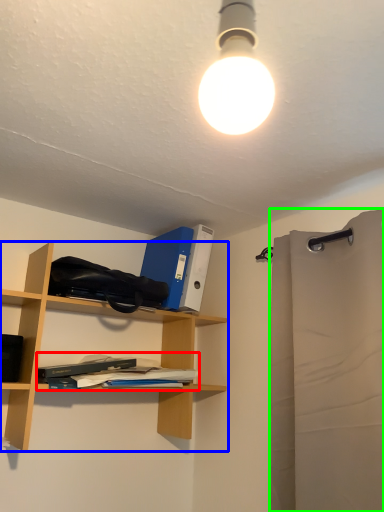
Question: Which object is positioned farthest from book (highlighted by a red box)? Select from shelf (highlighted by a blue box) and shower curtain (highlighted by a green box).

Choices:
 (A) shelf
 (B) shower curtain

Answer: (B)